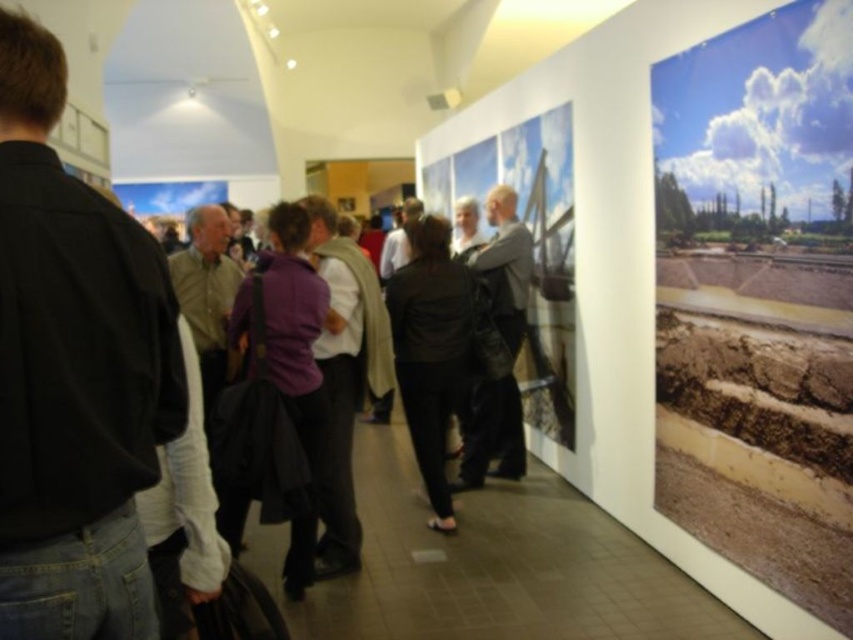
Can you confirm if black shirt at left is shorter than light brown leather jacket at center?

Yes.

Locate an element on the screen. The width and height of the screenshot is (853, 640). black shirt at left is located at coordinates (74, 372).

Which of these two, purple fabric jacket at center or light brown leather jacket at center, stands taller?

Standing taller between the two is light brown leather jacket at center.

Which is above, purple fabric jacket at center or light brown leather jacket at center?

light brown leather jacket at center is above.

Is point (271, 380) in front of point (508, 476)?

Yes, point (271, 380) is in front of point (508, 476).

Where is `purple fabric jacket at center`? The image size is (853, 640). purple fabric jacket at center is located at coordinates (293, 321).

Which of these two, black shirt at left or purple fabric jacket at center, stands shorter?

black shirt at left

Can you confirm if black shirt at left is positioned to the right of purple fabric jacket at center?

Indeed, black shirt at left is positioned on the right side of purple fabric jacket at center.

Between point (25, 554) and point (236, 524), which one is positioned behind?

The point (236, 524) is more distant.

Locate an element on the screen. black shirt at left is located at coordinates (74, 372).